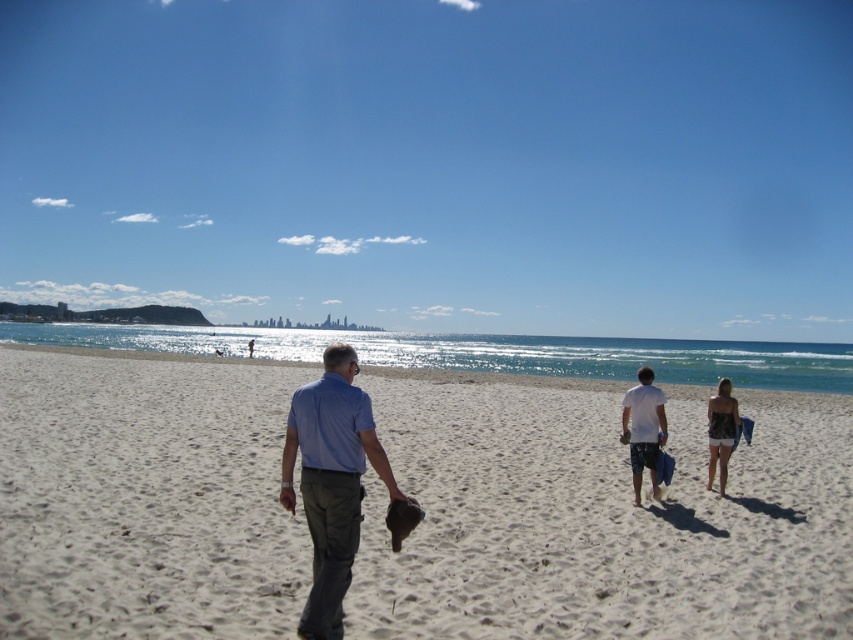
Does blue cotton shirt at center have a lesser height compared to white cotton t-shirt at center-right?

No, blue cotton shirt at center is not shorter than white cotton t-shirt at center-right.

Who is lower down, blue cotton shirt at center or white cotton t-shirt at center-right?

white cotton t-shirt at center-right is below.

Between point (329, 444) and point (651, 401), which one is positioned in front?

Point (329, 444) is more forward.

What are the coordinates of `blue cotton shirt at center` in the screenshot? It's located at (331, 481).

Is point (119, 166) in front of point (251, 605)?

No, it is behind (251, 605).

Is the position of blue sky at upper center more distant than that of white sandy beach at center?

Yes, blue sky at upper center is behind white sandy beach at center.

Between point (323, 310) and point (430, 464), which one is positioned in front?

Positioned in front is point (430, 464).

The height and width of the screenshot is (640, 853). Find the location of `blue sky at upper center`. blue sky at upper center is located at coordinates (434, 163).

Is blue cotton shirt at center taller than patterned fabric top at center right?

Correct, blue cotton shirt at center is much taller as patterned fabric top at center right.

Which is behind, point (357, 403) or point (709, 404)?

The point (709, 404) is more distant.

Between point (287, 465) and point (717, 442), which one is positioned behind?

The point (717, 442) is more distant.

Identify the location of blue cotton shirt at center. The image size is (853, 640). (331, 481).